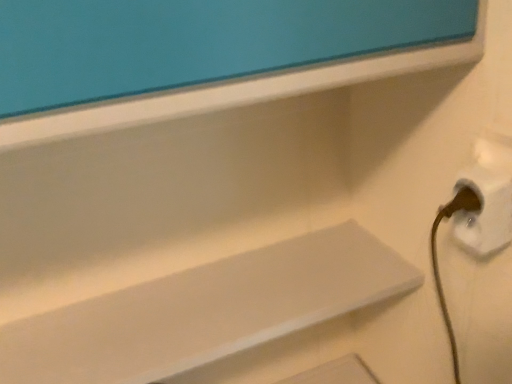
At what (x,y) coordinates should I click in order to perform the action: click on blank space situated above white matte shelf at center (from a real-world perspective). Please return your answer as a coordinate pair (x, y). Looking at the image, I should click on (199, 314).